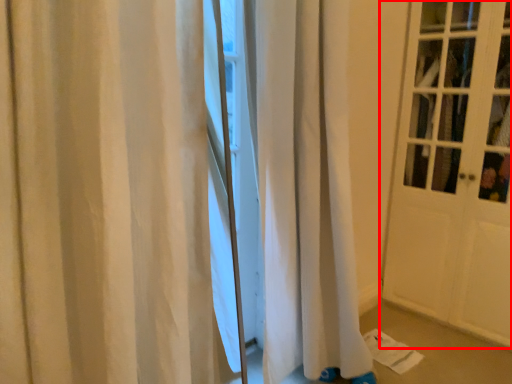
Question: From the image's perspective, where is door (annotated by the red box) located in relation to curtain in the image?

Choices:
 (A) below
 (B) above

Answer: (B)